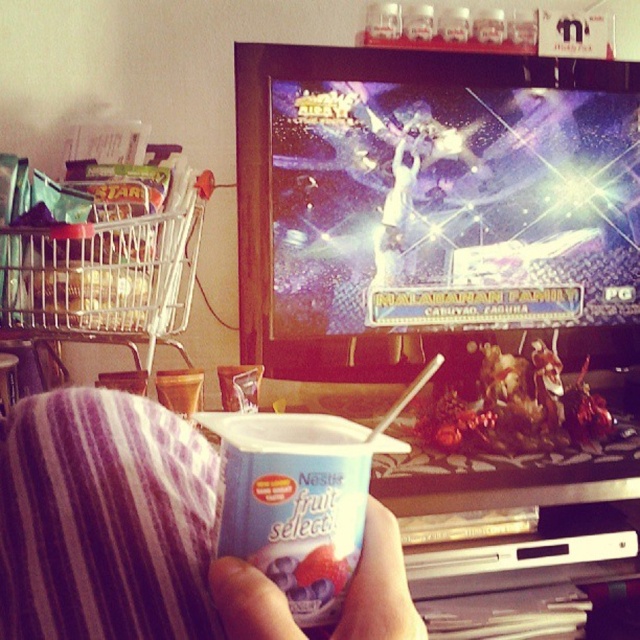
Can you confirm if purple striped fabric at lower left is positioned to the right of metallic wire shopping cart at left?

Yes, purple striped fabric at lower left is to the right of metallic wire shopping cart at left.

Between purple striped fabric at lower left and metallic wire shopping cart at left, which one has less height?

purple striped fabric at lower left

Does point (385, 557) lie behind point (58, 268)?

No, (385, 557) is in front of (58, 268).

I want to click on purple striped fabric at lower left, so click(118, 528).

This screenshot has width=640, height=640. What do you see at coordinates (118, 528) in the screenshot?
I see `purple striped fabric at lower left` at bounding box center [118, 528].

Which of these two, purple striped fabric at lower left or white matte cup at lower center, stands taller?

Standing taller between the two is purple striped fabric at lower left.

Where is `purple striped fabric at lower left`? The height and width of the screenshot is (640, 640). purple striped fabric at lower left is located at coordinates (118, 528).

Which is in front, point (186, 252) or point (358, 632)?

Point (358, 632) is in front.

Is point (36, 362) less distant than point (387, 516)?

No, (36, 362) is behind (387, 516).

The image size is (640, 640). Identify the location of metallic wire shopping cart at left. (106, 273).